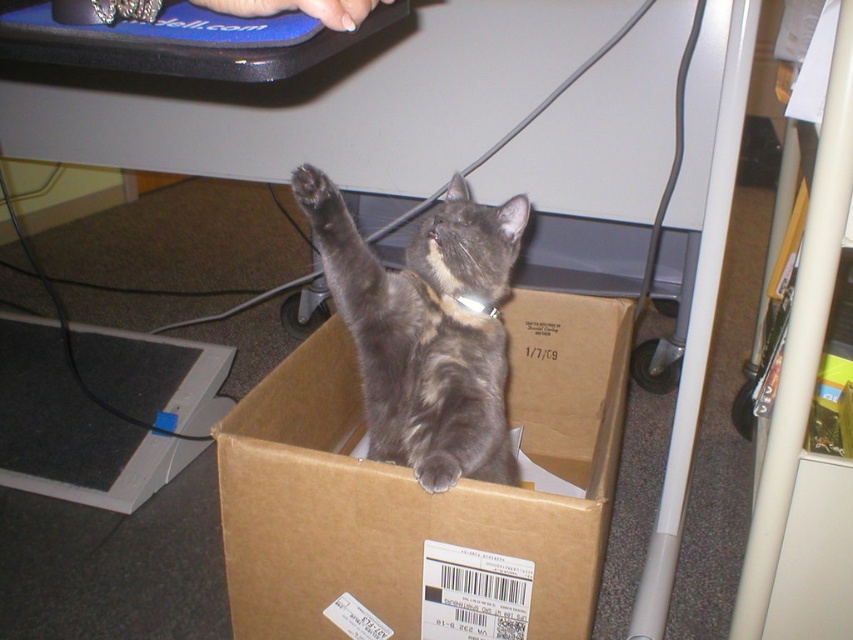
Question: Can you confirm if brown cardboard box at center is positioned to the right of gray fur paw at lower center?

Choices:
 (A) no
 (B) yes

Answer: (B)

Question: Which point is closer to the camera?

Choices:
 (A) (280, 552)
 (B) (469, 248)
 (C) (442, 468)

Answer: (C)

Question: Estimate the real-world distances between objects in this image. Which object is farther from the gray tabby cat at center?

Choices:
 (A) brown cardboard box at center
 (B) gray fur paw at upper center
 (C) gray fur paw at lower center

Answer: (B)

Question: Is gray fur paw at upper center to the left of gray fur paw at lower center from the viewer's perspective?

Choices:
 (A) no
 (B) yes

Answer: (B)

Question: Considering the real-world distances, which object is farthest from the gray fur paw at lower center?

Choices:
 (A) gray fur paw at upper center
 (B) gray tabby cat at center

Answer: (A)

Question: Is gray fur paw at upper center to the left of gray fur paw at lower center from the viewer's perspective?

Choices:
 (A) no
 (B) yes

Answer: (B)